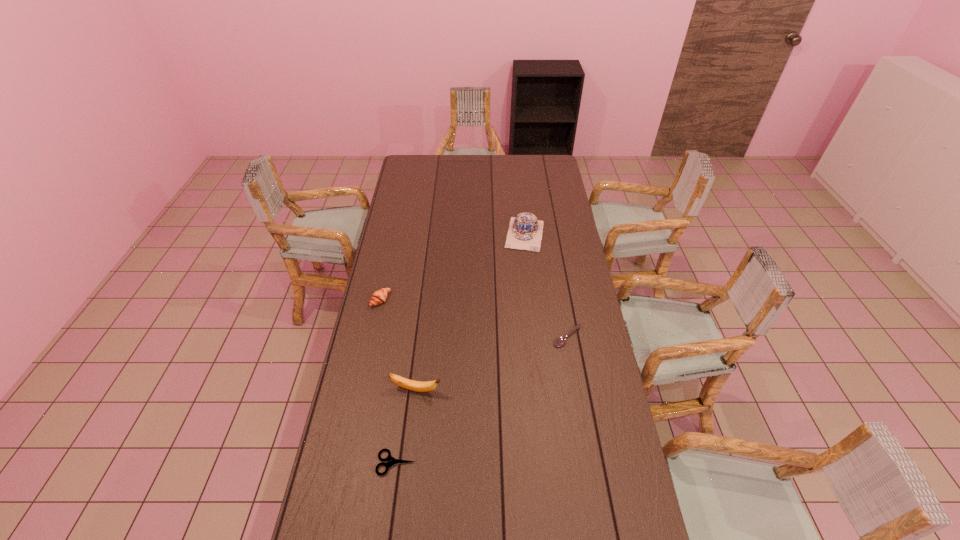
Locate an element on the screen. The width and height of the screenshot is (960, 540). banana positioned at the left edge is located at coordinates (418, 386).

The image size is (960, 540). Identify the location of pastry that is at the left edge. (380, 296).

The height and width of the screenshot is (540, 960). Find the location of `soupspoon present at the right edge`. soupspoon present at the right edge is located at coordinates (560, 341).

Identify the location of cap located at the right edge. (525, 232).

In the image, there is a desktop. Where is `blank space at the far edge`? blank space at the far edge is located at coordinates (522, 170).

At what (x,y) coordinates should I click in order to perform the action: click on free spot at the near edge of the desktop. Please return your answer as a coordinate pair (x, y). Looking at the image, I should click on (527, 514).

At what (x,y) coordinates should I click in order to perform the action: click on vacant space at the left edge of the desktop. Please return your answer as a coordinate pair (x, y). The width and height of the screenshot is (960, 540). Looking at the image, I should click on (369, 358).

In the image, there is a desktop. Identify the location of vacant region at the right edge. This screenshot has width=960, height=540. click(563, 185).

This screenshot has width=960, height=540. What are the coordinates of `free region at the far left corner` in the screenshot? It's located at (412, 162).

Find the location of `vacant space at the near right corner of the desktop`. vacant space at the near right corner of the desktop is located at coordinates (591, 503).